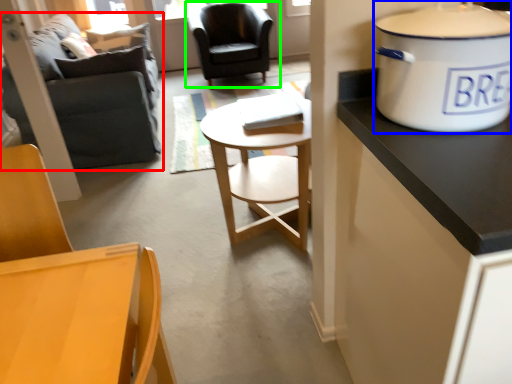
Question: Which is farther away from studio couch (highlighted by a red box)? cooker (highlighted by a blue box) or chair (highlighted by a green box)?

Choices:
 (A) cooker
 (B) chair

Answer: (A)